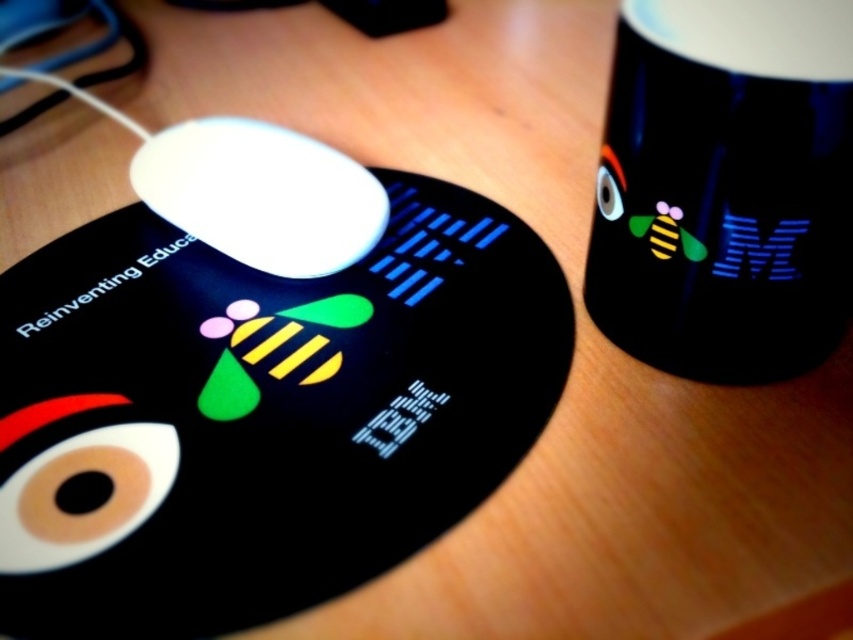
Question: Can you confirm if black matte mug at upper right is smaller than white glossy mouse at center?

Choices:
 (A) yes
 (B) no

Answer: (B)

Question: Among these objects, which one is nearest to the camera?

Choices:
 (A) black matte mug at upper right
 (B) white glossy mouse at center

Answer: (A)

Question: In this image, where is black matte mug at upper right located relative to white glossy mouse at center?

Choices:
 (A) above
 (B) below

Answer: (B)

Question: Can you confirm if black matte mug at upper right is smaller than white glossy mouse at center?

Choices:
 (A) no
 (B) yes

Answer: (A)

Question: Among these points, which one is farthest from the camera?

Choices:
 (A) (332, 150)
 (B) (711, 83)

Answer: (A)

Question: Which object appears farthest from the camera in this image?

Choices:
 (A) white glossy mouse at center
 (B) black matte mug at upper right

Answer: (A)